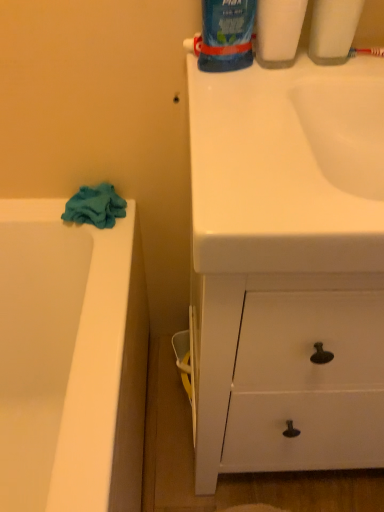
Identify the location of free location in front of blue glossy toothpaste at upper center, which is the 1th cleaning product from left to right. This screenshot has height=512, width=384. (238, 106).